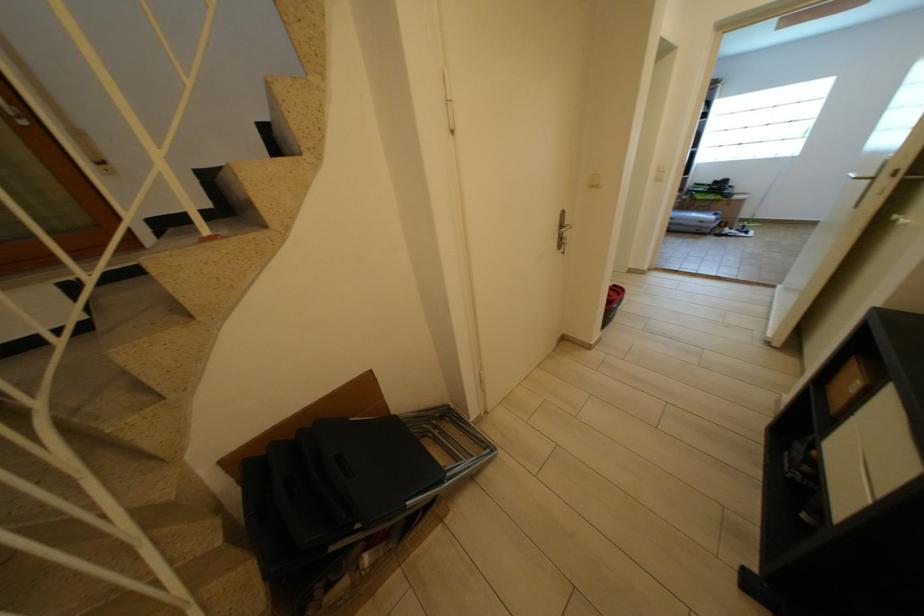
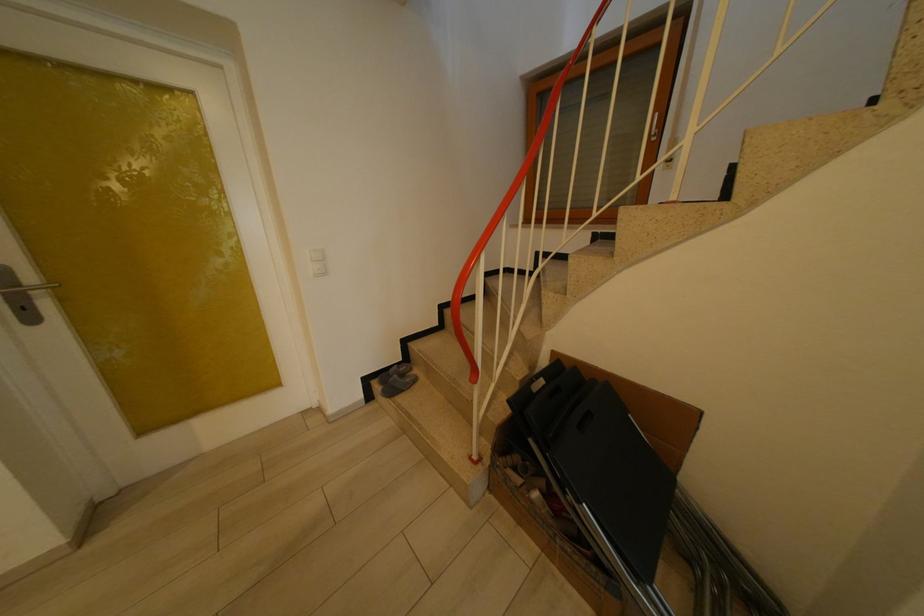
First-person continuous shooting, in which direction is the camera rotating?

The camera's rotation is toward left-down.